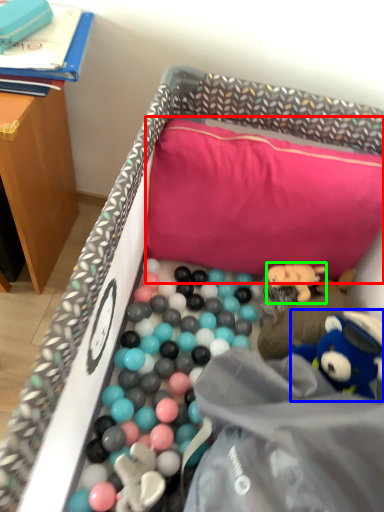
Question: Estimate the real-world distances between objects in this image. Which object is farther from pillow (highlighted by a red box), toy (highlighted by a blue box) or toy (highlighted by a green box)?

Choices:
 (A) toy
 (B) toy

Answer: (A)